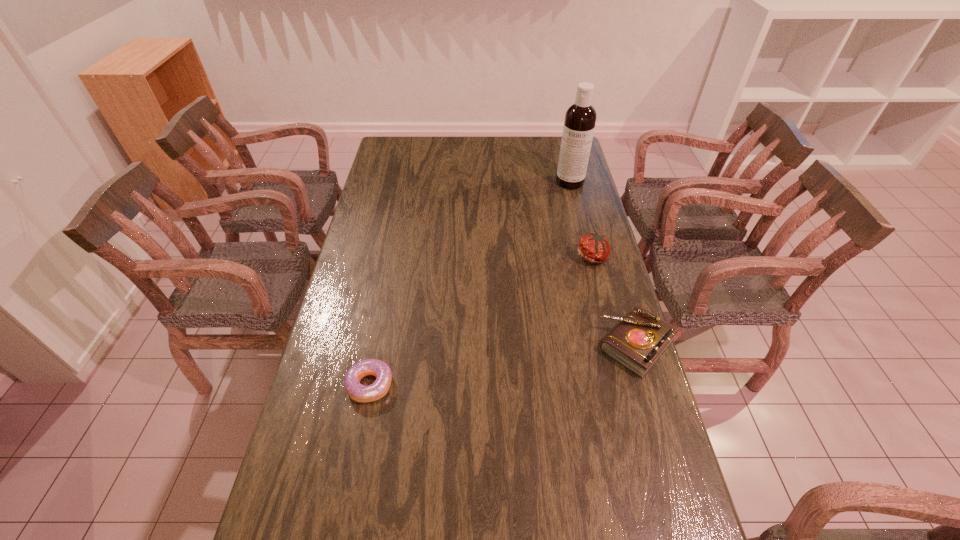
Identify the location of vacant spot on the desktop that is between the doughnut and the diary and is positioned on the front-facing side of the third nearest object. This screenshot has width=960, height=540. (x=471, y=369).

This screenshot has width=960, height=540. Identify the location of vacant spot on the desktop that is between the doughnut and the third tallest object and is positioned on the label side of the dishwasher detergent. (531, 361).